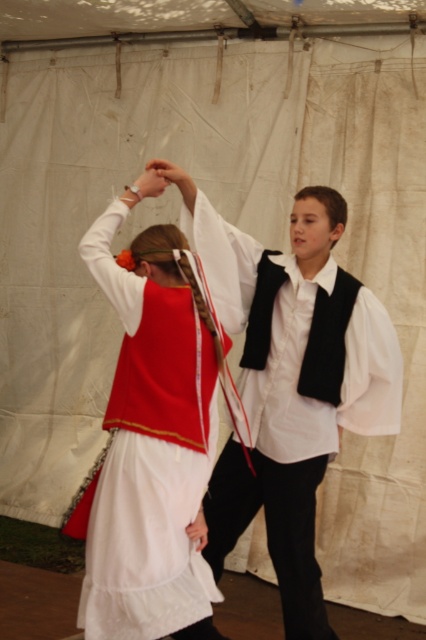
Between white matte vest at center and matte red vest at center, which one has less height?

matte red vest at center

Is white matte vest at center to the left of matte red vest at center from the viewer's perspective?

In fact, white matte vest at center is to the right of matte red vest at center.

Which is in front, point (391, 364) or point (71, 531)?

Point (71, 531) is more forward.

This screenshot has width=426, height=640. I want to click on white matte vest at center, so click(291, 381).